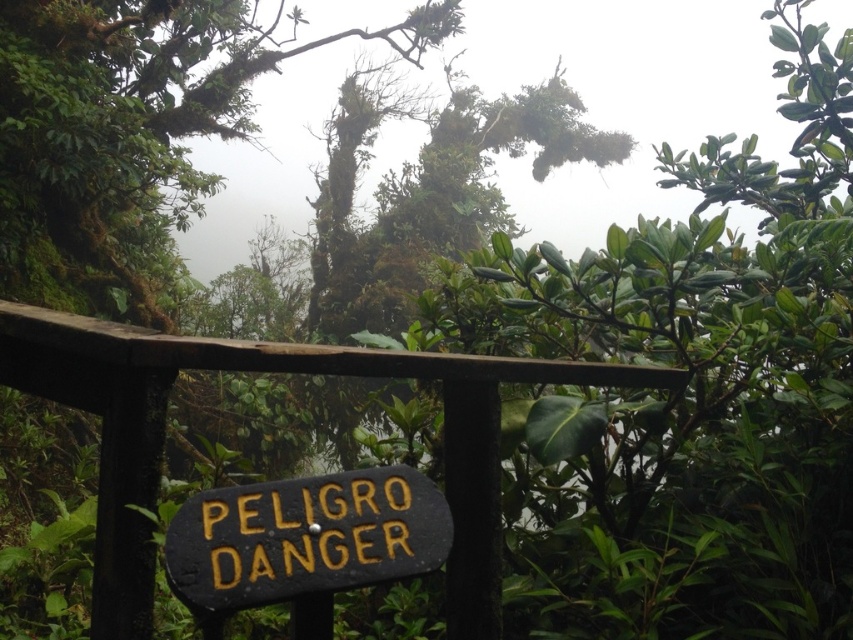
You are a maintenance worker needing to inspect the brown wood rail at center. Your tool kit is 1.5 meters long. Can you safely place it on the ground between you and the rail without it extending beyond the rail?

The distance between you and the brown wood rail at center is 1.57 meters, which is slightly longer than your 1.5 meter tool kit. Therefore, you can safely place the tool kit on the ground between you and the rail without it extending beyond the rail.

You are standing at the wooden railing in the forest scene. There are two points marked in the image. One is at coordinates point (567, 371) and the other at point (171, 570). From your current position behind the railing, which point is closer to you?

Point (171, 570) is closer to you because the description states that point (567, 371) is behind point (171, 570), meaning the latter is in front and therefore nearer.

You are a park ranger inspecting the brown wood rail at center and the black painted wood sign at center. Which object is wider?

The brown wood rail at center is wider than the black painted wood sign at center.